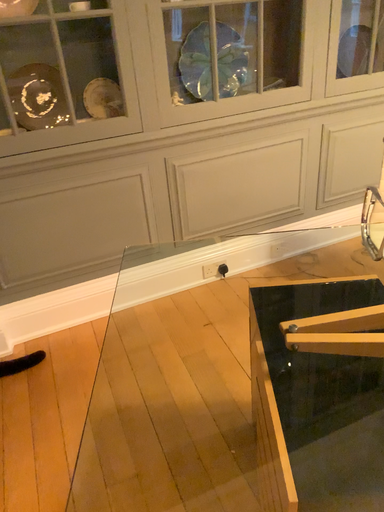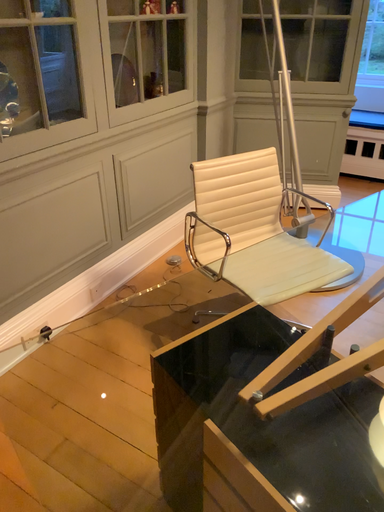
Question: Which way did the camera rotate in the video?

Choices:
 (A) rotated upward
 (B) rotated downward

Answer: (A)